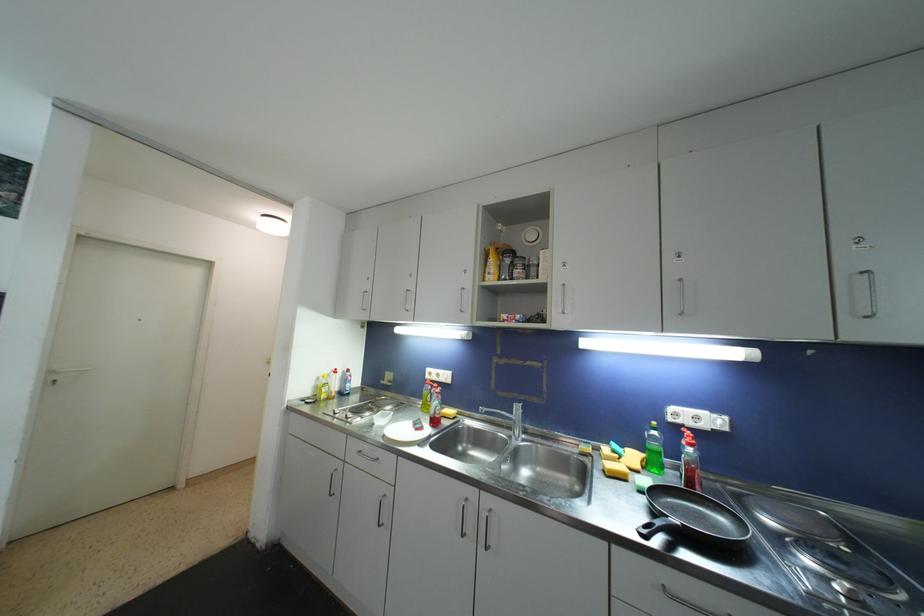
What do you see at coordinates (367, 456) in the screenshot? I see `the metal drawer handle` at bounding box center [367, 456].